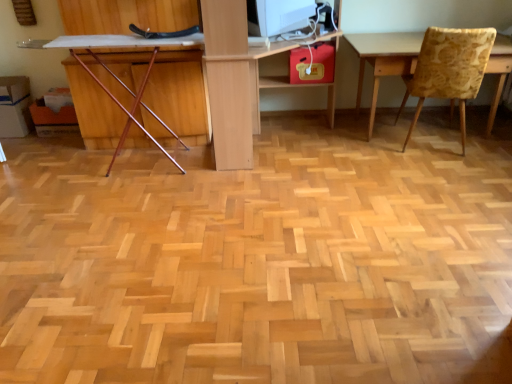
Find the location of `free spot below light wood computer desk at center (from a real-world perspective)`. free spot below light wood computer desk at center (from a real-world perspective) is located at coordinates (292, 137).